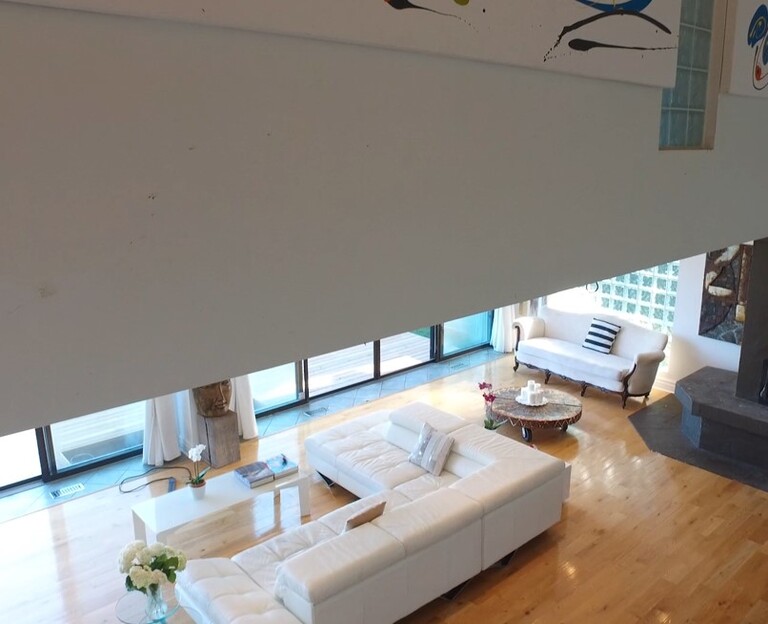
At what (x,y) coordinates should I click in order to perform the action: click on white coffee table. Please return your answer as a coordinate pair (x, y). Image resolution: width=768 pixels, height=624 pixels. Looking at the image, I should click on point(227,490).